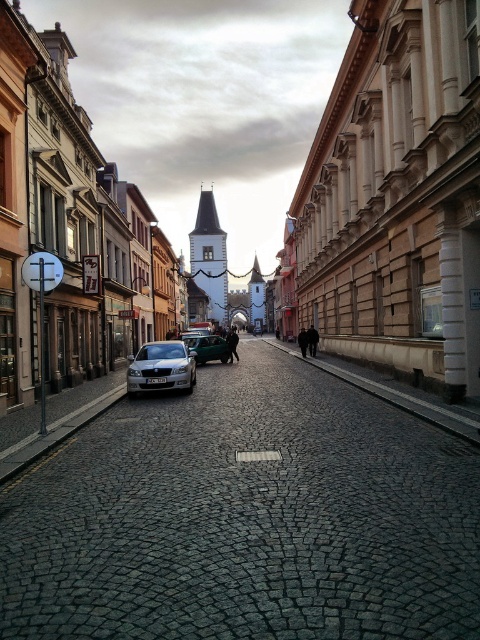
Question: From the image, what is the correct spatial relationship of shiny silver car at center in relation to metallic silver car at center?

Choices:
 (A) left
 (B) right

Answer: (B)

Question: Estimate the real-world distances between objects in this image. Which object is closer to the silver metallic sedan at center?

Choices:
 (A) metallic silver car at center
 (B) matte stone street at center

Answer: (A)

Question: Is shiny silver car at center to the right of silver metallic sedan at center from the viewer's perspective?

Choices:
 (A) yes
 (B) no

Answer: (A)

Question: Which object is positioned farthest from the silver metallic sedan at center?

Choices:
 (A) shiny silver car at center
 (B) matte stone street at center

Answer: (B)

Question: Is shiny silver car at center closer to the viewer compared to silver metallic sedan at center?

Choices:
 (A) yes
 (B) no

Answer: (A)

Question: Which point appears closest to the camera in this image?

Choices:
 (A) (437, 353)
 (B) (204, 349)
 (C) (179, 356)

Answer: (A)